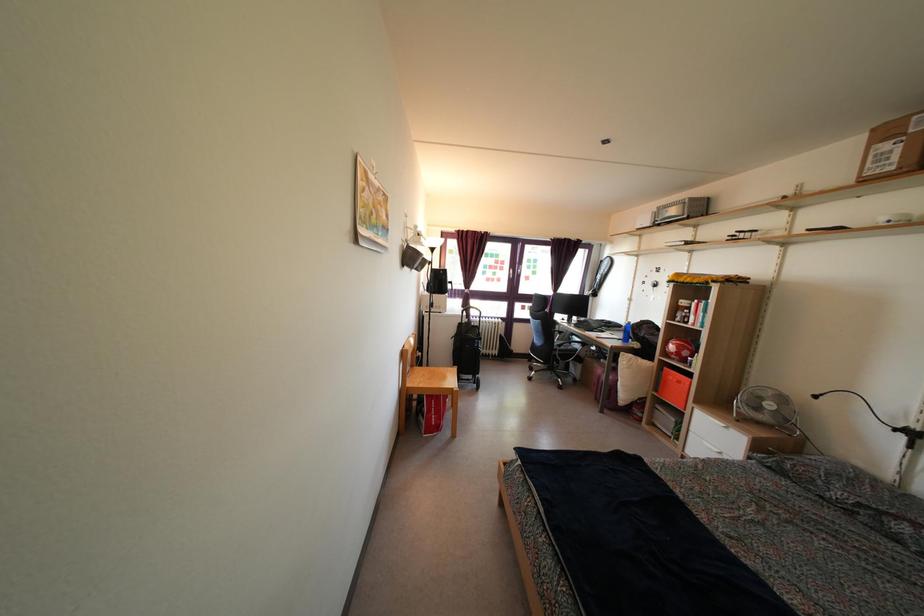
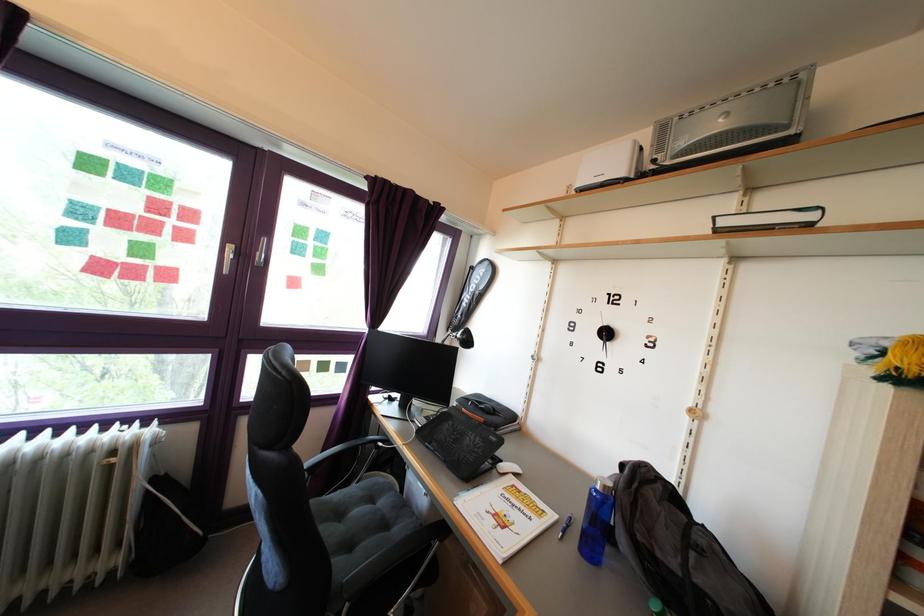
Find the pixel in the second image that matches (x=597, y=334) in the first image.

(472, 447)